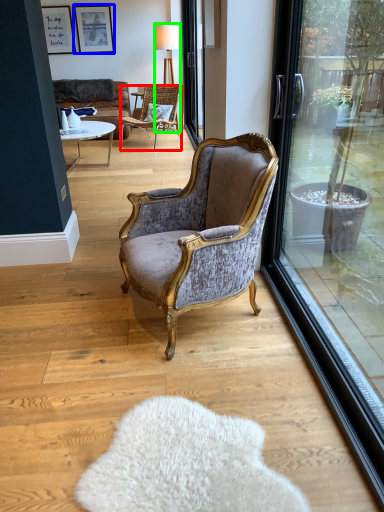
Question: Which object is the farthest from chair (highlighted by a red box)? Choose among these: picture frame (highlighted by a blue box) or lamp (highlighted by a green box).

Choices:
 (A) picture frame
 (B) lamp

Answer: (A)